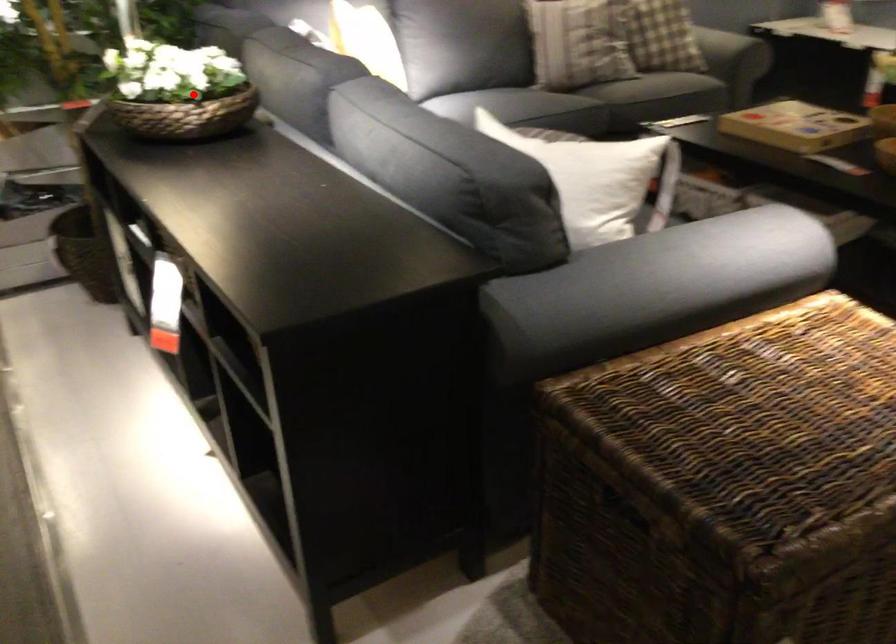
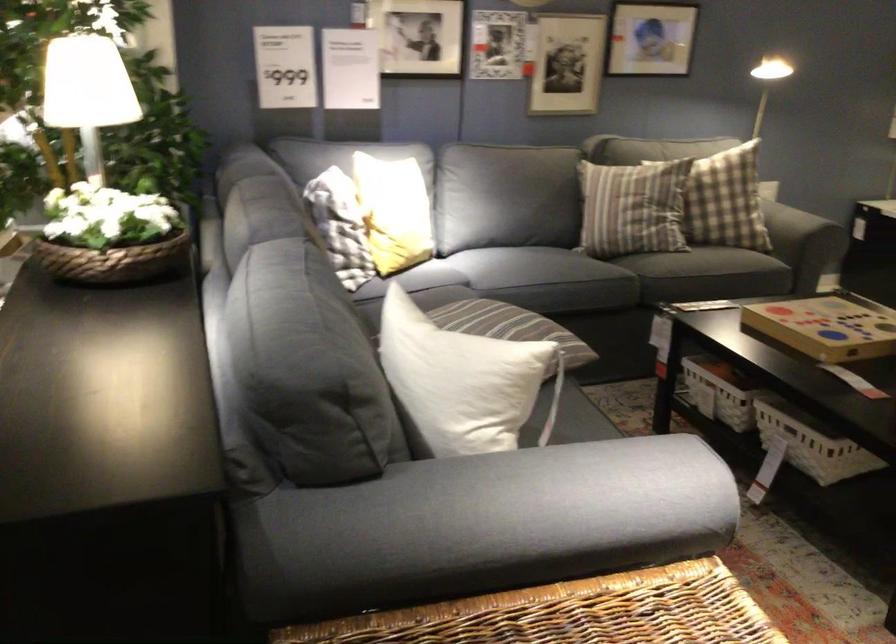
Find the pixel in the second image that matches the highlighted location in the first image.

(109, 236)